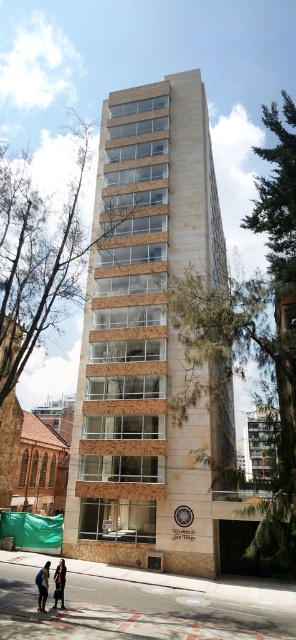
You are a photographer planning to take a wide shot of the beige stone building at center and the blue denim jeans at lower left. Which object should you focus on first if you want to ensure both are in frame without moving the camera?

The beige stone building at center is wider than the blue denim jeans at lower left, so you should focus on the beige stone building at center first to ensure both fit in the frame.

You are standing at the entrance of the beige stone building at center and want to hang a dark brown leather jacket at lower left 66.59 feet away. Is the jacket within a 50 feet security zone around the building?

The distance between the beige stone building at center and the dark brown leather jacket at lower left is 66.59 feet, which exceeds the 50 feet security zone. Therefore, the jacket is outside the security zone.

You are standing at the entrance of Recoleta de San Diego and want to take a photo of the point at coordinates (232,452). If your camera has a maximum focus range of 35 meters, will it be able to focus on that point?

The point at coordinates (232,452) is 35.89 meters away from the camera, which exceeds the camera maximum focus range of 35 meters. Therefore, the camera cannot focus on that point.